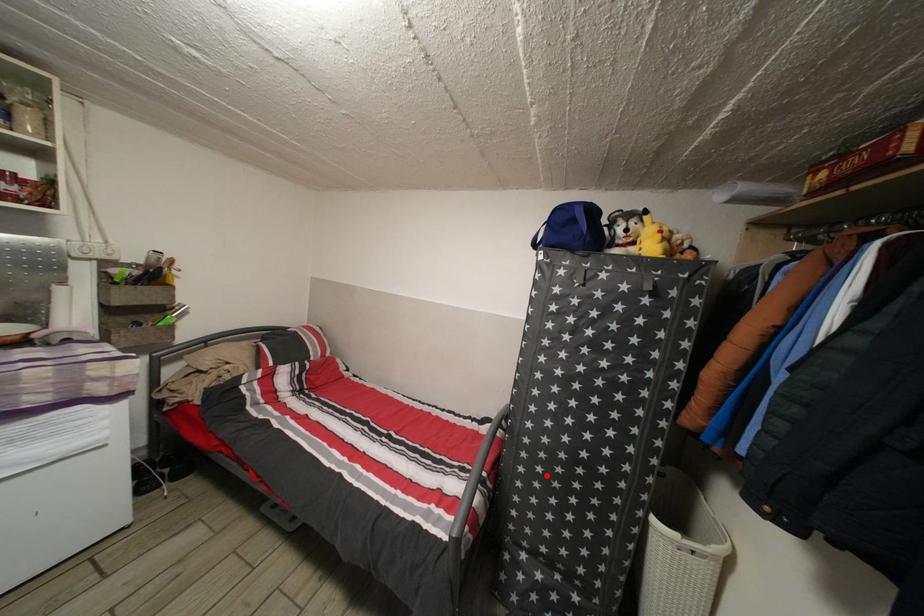
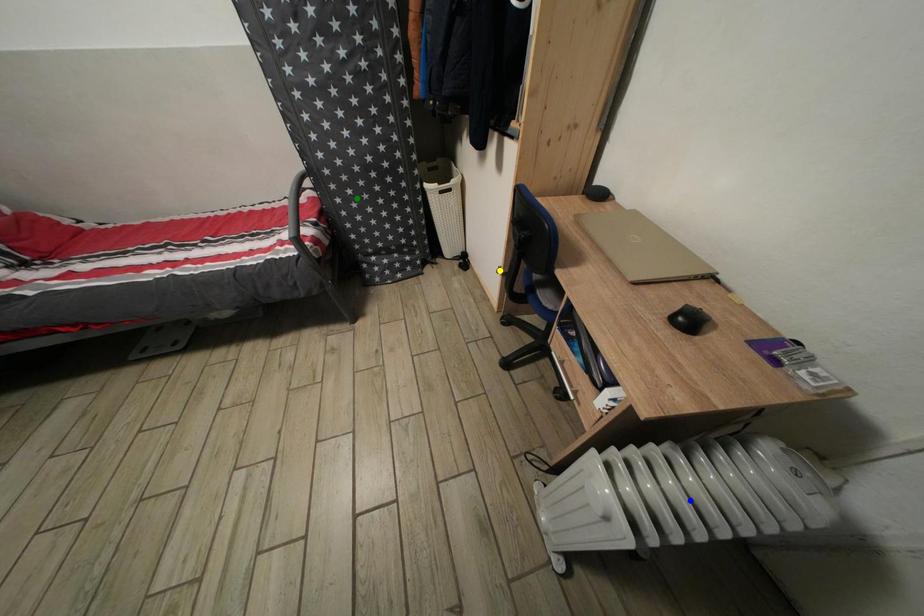
Question: I am providing you with two images of the same scene from different viewpoints. A red point is marked on the first image. You are given multiple points on the second image. In image 2, which mark is for the same physical point as the one in image 1?

Choices:
 (A) yellow point
 (B) green point
 (C) blue point

Answer: (B)